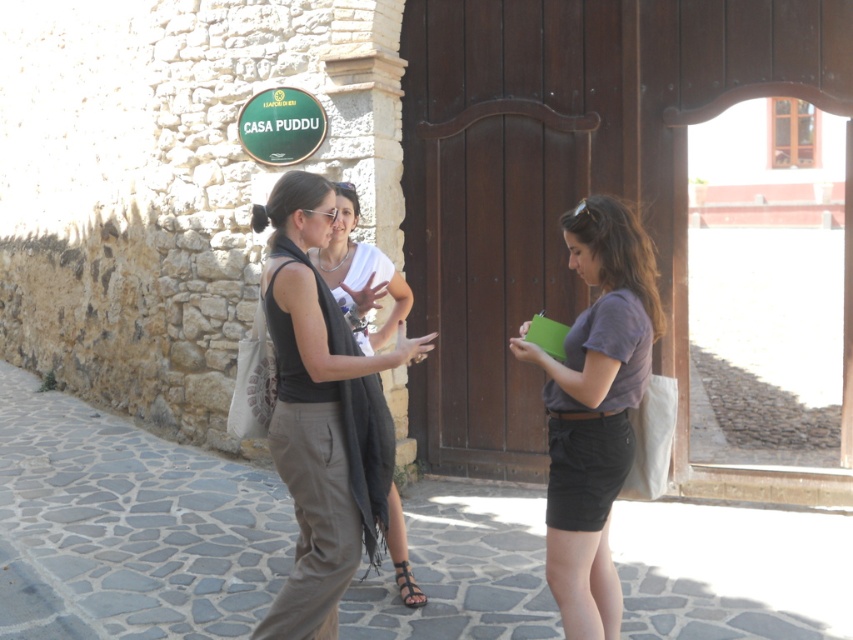
You are a delivery person standing at the entrance of the street. You need to deliver a package to the person wearing the dark gray fabric vest at center and the brown leather sandal at center. The package is 4 feet long. Can you hand over the package without needing to move either of the objects?

The distance between the dark gray fabric vest at center and the brown leather sandal at center is 4.35 feet. Since the package is 4 feet long, it can be placed between them without needing to move either object as there is sufficient space.